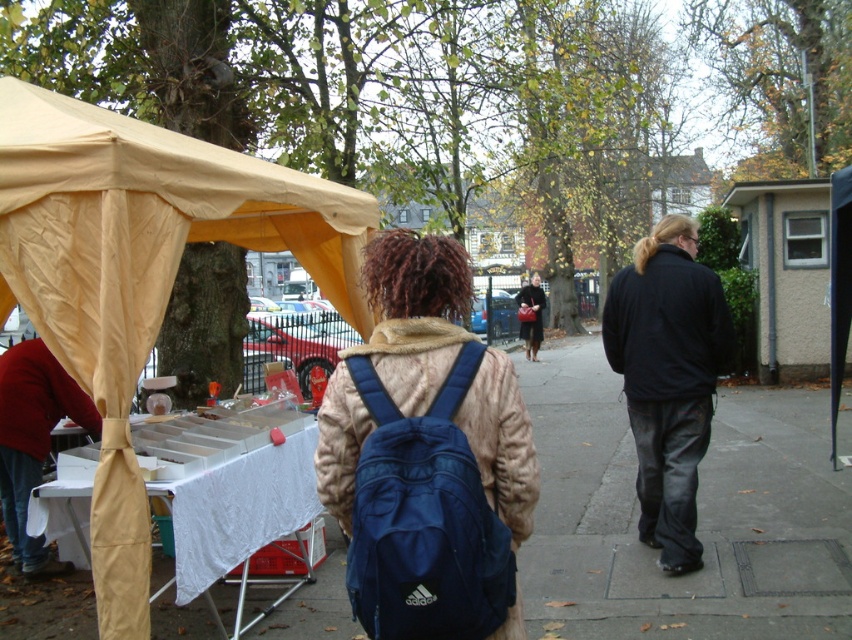
You are a photographer trying to capture a photo of the navy blue fabric backpack at center and the matte red sweater at left. Based on their sizes, which object should you focus on first to ensure both are clearly visible in the frame?

The navy blue fabric backpack at center has a smaller size compared to matte red sweater at left. To ensure both are clearly visible, focus on the smaller navy blue fabric backpack at center first, then adjust the frame to include the larger matte red sweater at left.

You are standing at the center of the park. You want to locate the beige fabric tent at left. Which direction should you look to find it?

The beige fabric tent at left is located at point 0.427 on the x axis and 0.167 on the y axis. Since you are at the center, you should look towards the left side of the park to find the beige fabric tent at left.

You are standing at the entrance of the market and see the navy blue fabric backpack at center and the matte red sweater at left. Which item is closer to you?

The navy blue fabric backpack at center is closer to you because it is in front of the matte red sweater at left.